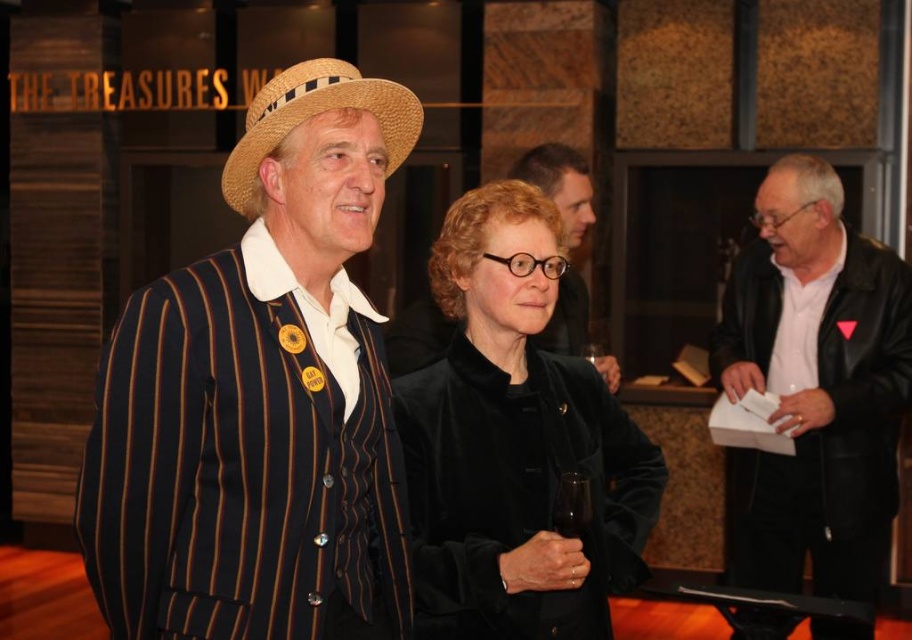
You are organizing a coat rack for guests at the event. There is a black leather jacket at right and a transparent glass at center. Which item requires more space on the coat rack?

The black leather jacket at right requires more space on the coat rack because it is larger in size than the transparent glass at center.

You are organizing a coat rack for guests at the event. You have a coat hanger that is 12 inches wide. The black leather jacket at right and the strawhat at center need to be hung. Which item can fit on the hanger without overlapping the edges?

The strawhat at center can fit on the hanger since the black leather jacket at right is wider than the strawhat at center, and the hanger is 12 inches wide.

From the picture: You are organizing a coat rack for guests at the event. You have a space that can only accommodate one jacket at a time. If you need to choose between the black leather jacket at right and the matte black jacket at center, which one would you place first to ensure it fits properly?

The matte black jacket at center should be placed first because the black leather jacket at right might be wider and could require more space, so prioritizing the narrower matte black jacket at center ensures it fits before the potentially wider one.